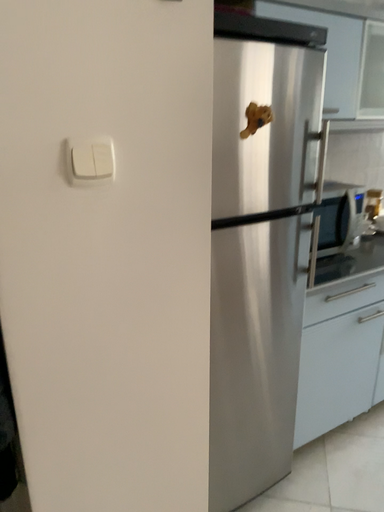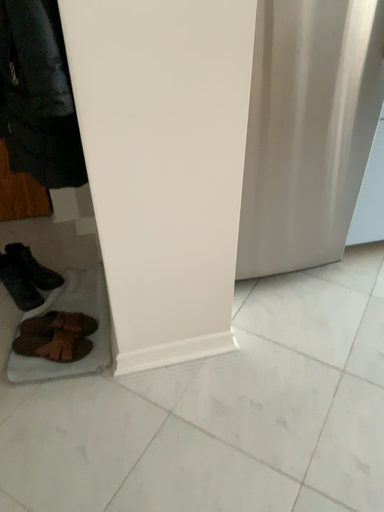
Question: Which way did the camera rotate in the video?

Choices:
 (A) rotated downward
 (B) rotated upward

Answer: (A)